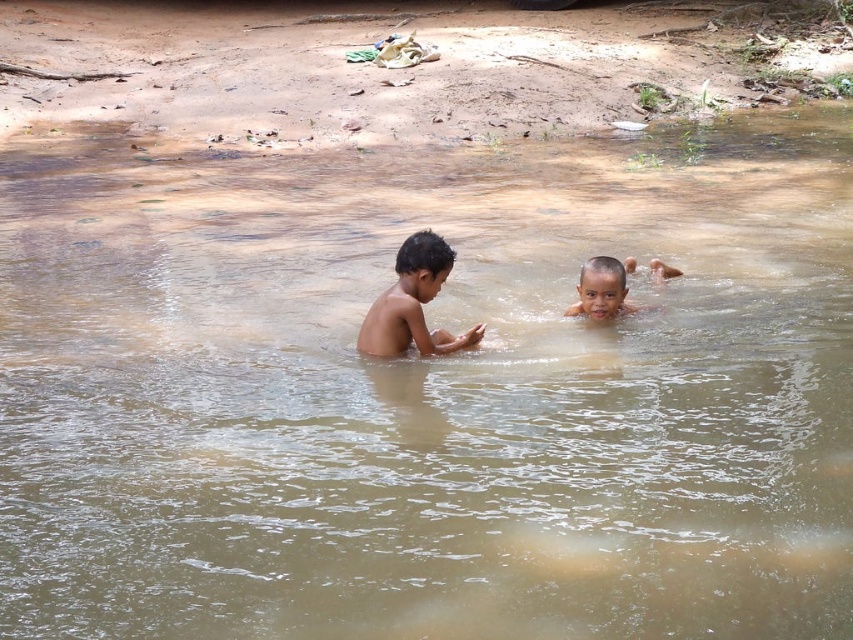
You are a photographer trying to capture the perfect shot of the light brown skin at center in the image. To ensure the subject is centered in your frame, you need to adjust your camera. What are the coordinates you should aim for?

The coordinates for the light brown skin at center are at point (413, 304), so you should aim your camera at those coordinates to center the subject.

You are a lifeguard on duty and notice two children in the water. The children are light brown skin at center and smooth skin child at center. How far apart are they from each other?

The light brown skin at center is 1.04 meters from smooth skin child at center.